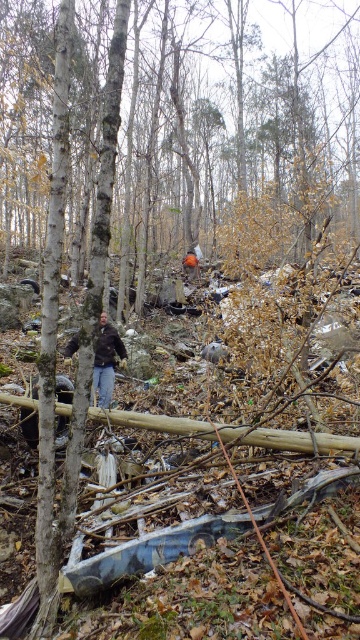
You are a hiker lost in the woods and you see the dark brown leather jacket at center and the orange fabric person at center. Which one is closer to you?

The dark brown leather jacket at center is closer to you because it is located below the orange fabric person at center, indicating it is positioned lower in the visual plane, which typically corresponds to being nearer in such scenes.

You are standing at the point marked by the coordinates point (x=106, y=360). Looking around, you see a man in a dark brown leather jacket at center. Can you determine the direction of the man relative to your position?

The man in a dark brown leather jacket at center is located at the same coordinates as your position, point (x=106, y=360), so he is right where you are standing.

You are a park ranger in the woods and see the dark brown leather jacket at center and the orange fabric person at center. Which one is more to the left?

The dark brown leather jacket at center is more to the left.